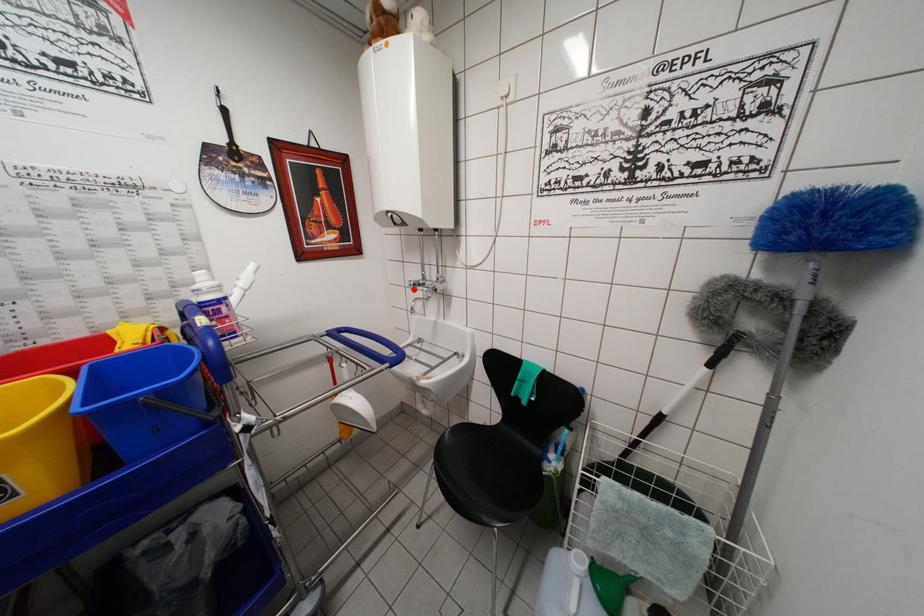
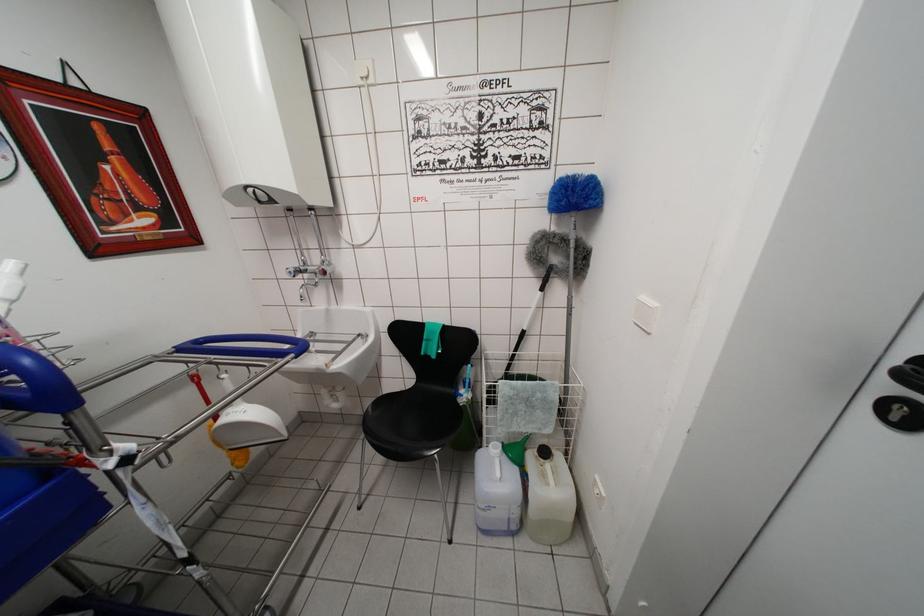
Where in the second image is the point corresponding to the highlighted location from the first image?

(293, 277)